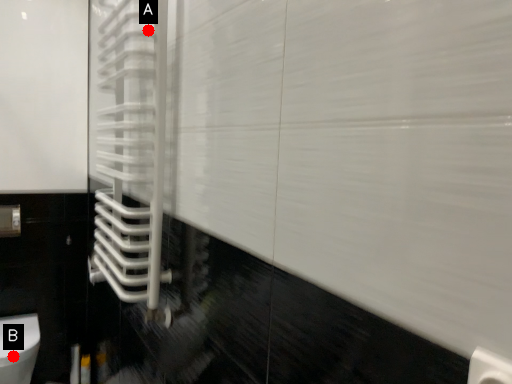
Question: Two points are circled on the image, labeled by A and B beside each circle. Which point is closer to the camera?

Choices:
 (A) A is closer
 (B) B is closer

Answer: (A)